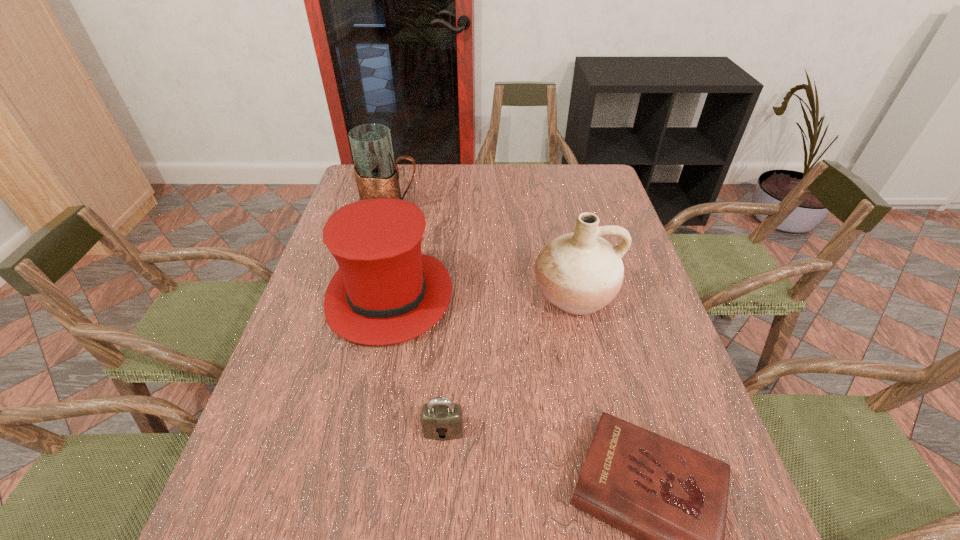
Find the location of a particular element. This screenshot has width=960, height=540. hat that is at the left edge is located at coordinates (385, 291).

Where is `object at the right edge`? This screenshot has width=960, height=540. object at the right edge is located at coordinates 580,273.

This screenshot has width=960, height=540. I want to click on object located in the far left corner section of the desktop, so click(377, 176).

Identify the location of vacant space at the far edge of the desktop. (451, 165).

Image resolution: width=960 pixels, height=540 pixels. I want to click on free region at the near edge, so click(x=396, y=530).

Where is `free space at the left edge of the desktop`? This screenshot has height=540, width=960. free space at the left edge of the desktop is located at coordinates (295, 433).

In the image, there is a desktop. Identify the location of free space at the right edge. (636, 295).

In the image, there is a desktop. Where is `vacant space at the far right corner`? The height and width of the screenshot is (540, 960). vacant space at the far right corner is located at coordinates 579,182.

Where is `free spot between the fourth tallest object and the hat`? free spot between the fourth tallest object and the hat is located at coordinates (417, 363).

The height and width of the screenshot is (540, 960). I want to click on blank region between the fourth tallest object and the hat, so click(x=417, y=363).